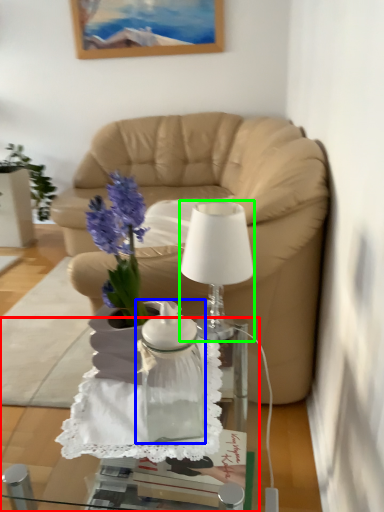
Question: Which object is the closest to the desk (highlighted by a red box)? Choose among these: vase (highlighted by a blue box) or lamp (highlighted by a green box).

Choices:
 (A) vase
 (B) lamp

Answer: (A)